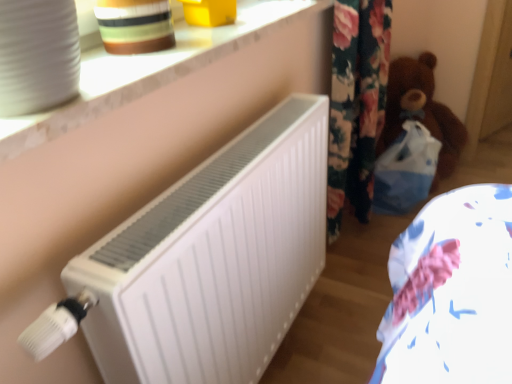
What do you see at coordinates (149, 71) in the screenshot? Image resolution: width=512 pixels, height=384 pixels. I see `white marble window sill at upper center` at bounding box center [149, 71].

You are a GUI agent. You are given a task and a screenshot of the screen. Output one action in this format:
    pyautogui.click(x=<x>, y=<y>)
    Task: Click on the white marble window sill at upper center
    
    Given the screenshot: What is the action you would take?
    pos(149,71)

Is white marble window sill at upper center bigger or smaller than striped ceramic pot at upper left?

white marble window sill at upper center is bigger than striped ceramic pot at upper left.

Is white marble window sill at upper center touching striped ceramic pot at upper left?

white marble window sill at upper center and striped ceramic pot at upper left are not in contact.

Can you confirm if white marble window sill at upper center is thinner than striped ceramic pot at upper left?

No.

Considering the sizes of objects white marble window sill at upper center and striped ceramic pot at upper left in the image provided, who is shorter, white marble window sill at upper center or striped ceramic pot at upper left?

white marble window sill at upper center is shorter.

How many degrees apart are the facing directions of striped ceramic pot at upper left and white matte radiator at center?

The facing directions of striped ceramic pot at upper left and white matte radiator at center are 3.09 degrees apart.

Is striped ceramic pot at upper left wider or thinner than white matte radiator at center?

striped ceramic pot at upper left is wider than white matte radiator at center.

From a real-world perspective, is striped ceramic pot at upper left located beneath white matte radiator at center?

Actually, striped ceramic pot at upper left is physically above white matte radiator at center in the real world.

Can you confirm if striped ceramic pot at upper left is positioned to the left of white matte radiator at center?

Indeed, striped ceramic pot at upper left is positioned on the left side of white matte radiator at center.

Which of these two, white marble window sill at upper center or brown plush teddy bear at right, stands taller?

Standing taller between the two is brown plush teddy bear at right.

Is white marble window sill at upper center thinner than brown plush teddy bear at right?

Yes.

Can you confirm if white marble window sill at upper center is positioned to the right of brown plush teddy bear at right?

Incorrect, white marble window sill at upper center is not on the right side of brown plush teddy bear at right.

I want to click on window sill above the brown plush teddy bear at right (from a real-world perspective), so click(149, 71).

Could you tell me if white matte radiator at center is facing white marble window sill at upper center?

No, white matte radiator at center does not turn towards white marble window sill at upper center.

Is white matte radiator at center positioned before white marble window sill at upper center?

No, white matte radiator at center is further to the viewer.

Is white matte radiator at center far from white marble window sill at upper center?

white matte radiator at center is actually quite close to white marble window sill at upper center.

Is brown plush teddy bear at right turned away from white marble window sill at upper center?

No.

From a real-world perspective, does brown plush teddy bear at right sit lower than white marble window sill at upper center?

Yes.

I want to click on teddy behind the white marble window sill at upper center, so click(421, 111).

From the image's perspective, is brown plush teddy bear at right on top of white marble window sill at upper center?

Actually, brown plush teddy bear at right appears below white marble window sill at upper center in the image.

Does white matte radiator at center have a lesser width compared to brown plush teddy bear at right?

Yes, white matte radiator at center is thinner than brown plush teddy bear at right.

Between white matte radiator at center and brown plush teddy bear at right, which one has more height?

With more height is white matte radiator at center.

Which is more to the left, white matte radiator at center or brown plush teddy bear at right?

white matte radiator at center is more to the left.

Where is `teddy above the white matte radiator at center (from the image's perspective)`? Image resolution: width=512 pixels, height=384 pixels. teddy above the white matte radiator at center (from the image's perspective) is located at coordinates (421, 111).

Based on the photo, can you confirm if brown plush teddy bear at right is bigger than striped ceramic pot at upper left?

Correct, brown plush teddy bear at right is larger in size than striped ceramic pot at upper left.

Between brown plush teddy bear at right and striped ceramic pot at upper left, which one has less height?

striped ceramic pot at upper left is shorter.

Between brown plush teddy bear at right and striped ceramic pot at upper left, which one is positioned in front?

striped ceramic pot at upper left.

Is brown plush teddy bear at right situated inside striped ceramic pot at upper left or outside?

brown plush teddy bear at right exists outside the volume of striped ceramic pot at upper left.

Where is `window sill in front of the striped ceramic pot at upper left`? window sill in front of the striped ceramic pot at upper left is located at coordinates pyautogui.click(x=149, y=71).

The width and height of the screenshot is (512, 384). Identify the location of radiator on the right of striped ceramic pot at upper left. (214, 259).

Considering their positions, is white matte radiator at center positioned further to striped ceramic pot at upper left than brown plush teddy bear at right?

The object further to striped ceramic pot at upper left is brown plush teddy bear at right.

Considering their positions, is white marble window sill at upper center positioned closer to striped ceramic pot at upper left than white matte radiator at center?

Among the two, white marble window sill at upper center is located nearer to striped ceramic pot at upper left.

Consider the image. When comparing their distances from white matte radiator at center, does white marble window sill at upper center or striped ceramic pot at upper left seem further?

Among the two, striped ceramic pot at upper left is located further to white matte radiator at center.

Based on their spatial positions, is white matte radiator at center or brown plush teddy bear at right further from white marble window sill at upper center?

brown plush teddy bear at right.

From the image, which object appears to be nearer to white matte radiator at center, white marble window sill at upper center or brown plush teddy bear at right?

white marble window sill at upper center is positioned closer to the anchor white matte radiator at center.

Based on their spatial positions, is white matte radiator at center or white marble window sill at upper center further from brown plush teddy bear at right?

Among the two, white matte radiator at center is located further to brown plush teddy bear at right.

Estimate the real-world distances between objects in this image. Which object is further from striped ceramic pot at upper left, white matte radiator at center or white marble window sill at upper center?

Based on the image, white matte radiator at center appears to be further to striped ceramic pot at upper left.

Looking at the image, which one is located further to white matte radiator at center, striped ceramic pot at upper left or brown plush teddy bear at right?

brown plush teddy bear at right is positioned further to the anchor white matte radiator at center.

Find the location of a particular element. The image size is (512, 384). radiator between white marble window sill at upper center and brown plush teddy bear at right along the z-axis is located at coordinates (214, 259).

Find the location of `pottery between white marble window sill at upper center and brown plush teddy bear at right along the z-axis`. pottery between white marble window sill at upper center and brown plush teddy bear at right along the z-axis is located at coordinates (135, 25).

Locate an element on the screen. pottery between white matte radiator at center and brown plush teddy bear at right in the front-back direction is located at coordinates (135, 25).

You are a GUI agent. You are given a task and a screenshot of the screen. Output one action in this format:
    pyautogui.click(x=<x>, y=<y>)
    Task: Click on the window sill between striped ceramic pot at upper left and white matte radiator at center in the up-down direction
    The height and width of the screenshot is (384, 512).
    Given the screenshot: What is the action you would take?
    pyautogui.click(x=149, y=71)